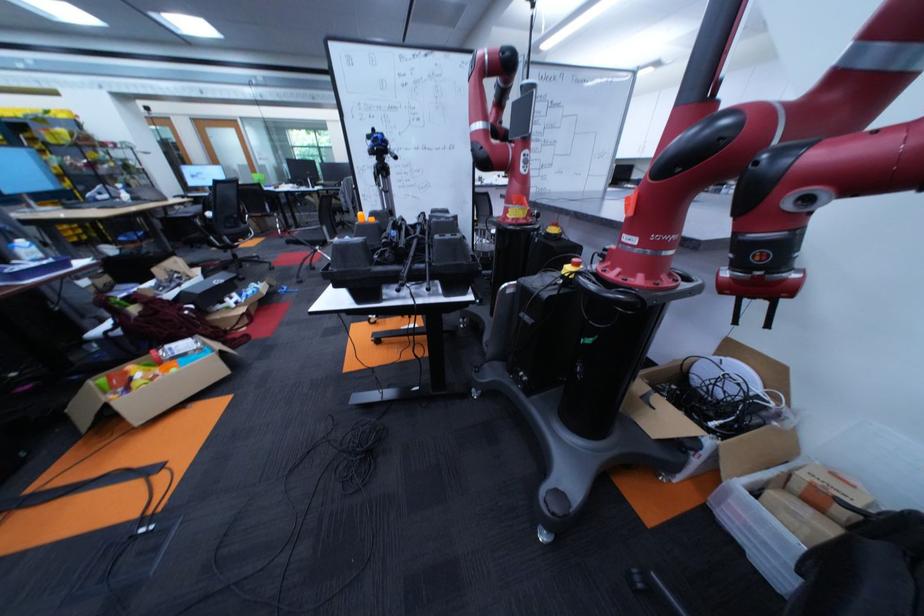
You are a GUI agent. You are given a task and a screenshot of the screen. Output one action in this format:
    pyautogui.click(x=<x>, y=<y>)
    Task: Click on the black chair armrest
    Image resolution: width=924 pixels, height=616 pixels.
    Given the screenshot: What is the action you would take?
    pyautogui.click(x=845, y=570)